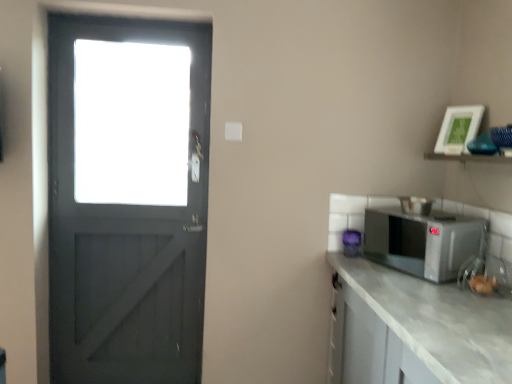
This screenshot has height=384, width=512. Find the location of `satin silver microwave at right`. satin silver microwave at right is located at coordinates (422, 242).

The height and width of the screenshot is (384, 512). Describe the element at coordinates (422, 242) in the screenshot. I see `satin silver microwave at right` at that location.

Measure the distance between point (405, 229) and camera.

Point (405, 229) is 3.29 meters from camera.

Locate an element on the screen. The height and width of the screenshot is (384, 512). satin silver microwave at right is located at coordinates (422, 242).